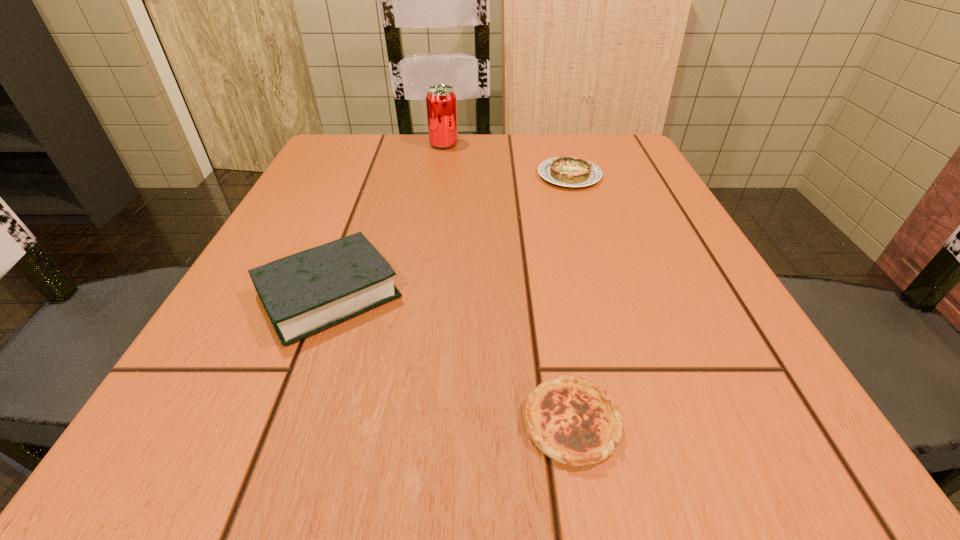
This screenshot has width=960, height=540. What are the coordinates of `free space between the Bible and the nearest object` in the screenshot? It's located at [450, 359].

Locate an element on the screen. vacant space that's between the third nearest object and the nearer quiche is located at coordinates (570, 299).

You are a GUI agent. You are given a task and a screenshot of the screen. Output one action in this format:
    pyautogui.click(x=<x>, y=<y>)
    Task: Click on the free space between the soda can and the nearest object
    
    Given the screenshot: What is the action you would take?
    pyautogui.click(x=508, y=284)

Choose which object is the third nearest neighbor to the nearest object. Please provide its 2D coordinates. Your answer should be formatted as a tuple, i.e. [(x, y)], where the tuple contains the x and y coordinates of a point satisfying the conditions above.

[(441, 101)]

The image size is (960, 540). Identify the location of object that ranks as the closest to the nearer quiche. (304, 293).

The height and width of the screenshot is (540, 960). In order to click on free space that satisfies the following two spatial constraints: 1. on the back side of the third farthest object; 2. on the left side of the third nearest object in this screenshot , I will do 374,176.

Where is `free space that satisfies the following two spatial constraints: 1. on the front side of the farthest object; 2. on the right side of the second farthest object`? The width and height of the screenshot is (960, 540). free space that satisfies the following two spatial constraints: 1. on the front side of the farthest object; 2. on the right side of the second farthest object is located at coordinates (440, 176).